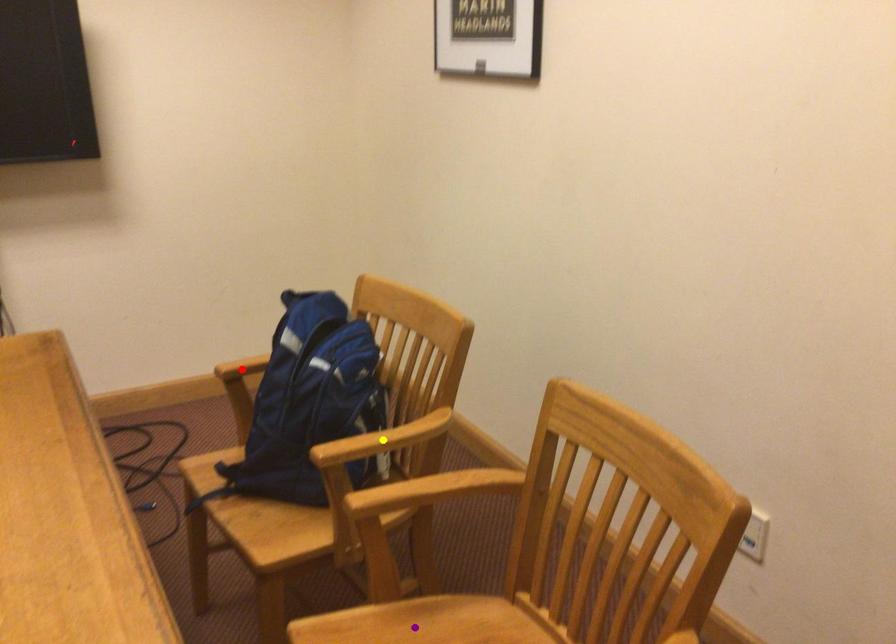
Order these from farthest to nearest:
red point | yellow point | purple point

red point → yellow point → purple point